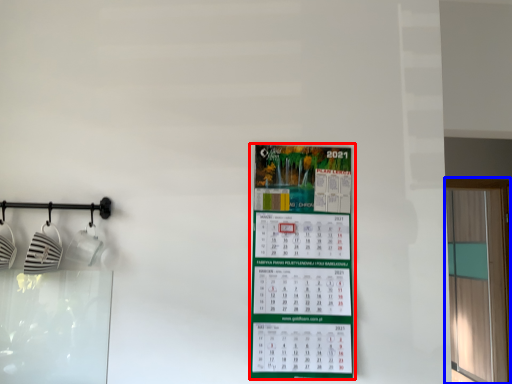
Question: Which object is further to the camera taking this photo, poster (highlighted by a red box) or window (highlighted by a blue box)?

Choices:
 (A) poster
 (B) window

Answer: (B)